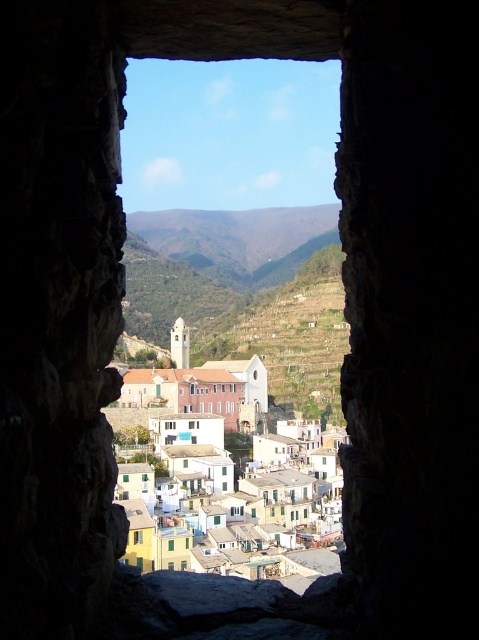
Question: Is transparent glass window at center below green matte window at center?

Choices:
 (A) no
 (B) yes

Answer: (A)

Question: Among these objects, which one is farthest from the camera?

Choices:
 (A) white matte window at center
 (B) green matte window at center
 (C) transparent glass window at center

Answer: (A)

Question: Which of the following is the farthest from the observer?

Choices:
 (A) white matte building at center
 (B) brown wooden window at center
 (C) transparent glass window at center

Answer: (B)

Question: Can you confirm if green matte window at center is positioned to the left of white matte window at center?

Choices:
 (A) yes
 (B) no

Answer: (A)

Question: Is green grassy hillside at center closer to camera compared to white matte window at center?

Choices:
 (A) no
 (B) yes

Answer: (A)

Question: Which object appears closest to the camera in this image?

Choices:
 (A) green grassy hillside at center
 (B) white matte window at center
 (C) pastel painted houses at center
 (D) transparent glass window at center

Answer: (C)